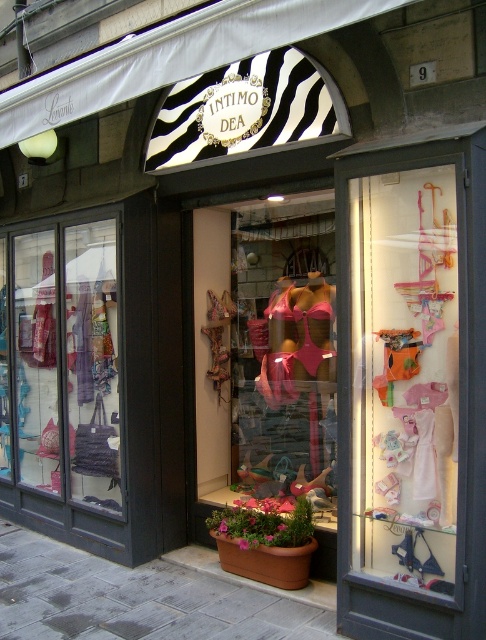
Does matte black bag at left appear under gray concrete pavement at lower center?

No.

What do you see at coordinates (68, 360) in the screenshot?
I see `matte black bag at left` at bounding box center [68, 360].

Locate an element on the screen. Image resolution: width=486 pixels, height=640 pixels. matte black bag at left is located at coordinates 68,360.